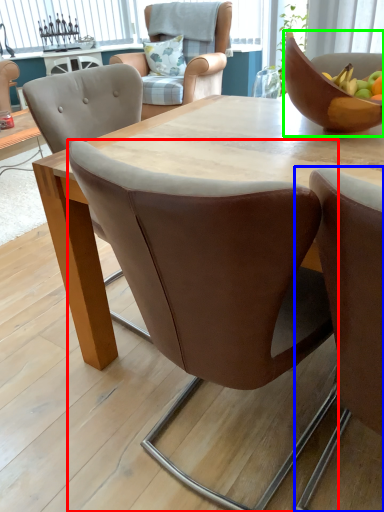
Question: Which object is the closest to the chair (highlighted by a red box)? Choose among these: chair (highlighted by a blue box) or bowl (highlighted by a green box).

Choices:
 (A) chair
 (B) bowl

Answer: (A)